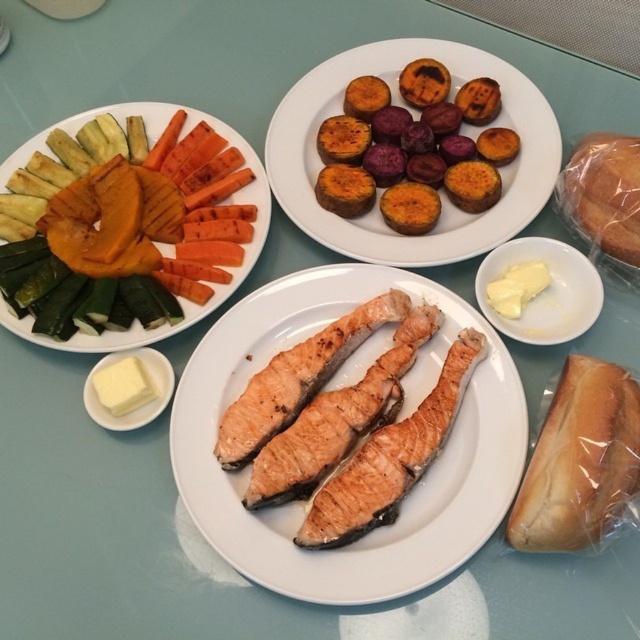
Question: Is golden-brown seared salmon at center above grilled vegetables at upper left?

Choices:
 (A) no
 (B) yes

Answer: (A)

Question: Which object appears farthest from the camera in this image?

Choices:
 (A) translucent plastic bread at upper right
 (B) white soft bread at lower right
 (C) golden brown salmon at center

Answer: (A)

Question: Which point is farther from the camera taking this photo?

Choices:
 (A) (138, 116)
 (B) (420, 432)

Answer: (A)

Question: In this image, where is white soft bread at lower right located relative to green zucchini at upper left?

Choices:
 (A) left
 (B) right

Answer: (B)

Question: Can you confirm if golden-brown seared salmon at center is wider than glistening pinkish salmon at center?

Choices:
 (A) no
 (B) yes

Answer: (A)

Question: Which of the following is the closest to the observer?

Choices:
 (A) grilled vegetables at upper left
 (B) smooth orange sweet potato slices at center
 (C) white soft bread at lower right
 (D) green zucchini at upper left

Answer: (C)